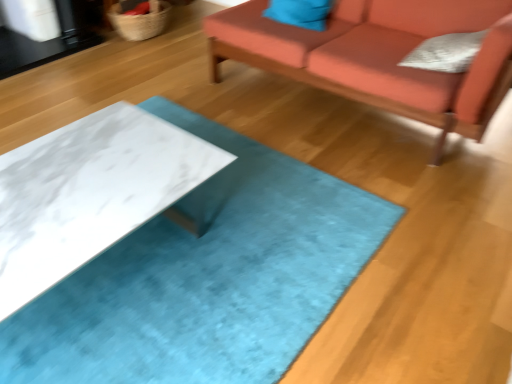
Question: From the image's perspective, is white marble table at center above or below white textured pillow at upper right, the 1th pillow positioned from the front?

Choices:
 (A) below
 (B) above

Answer: (A)

Question: Would you say white marble table at center is inside or outside white textured pillow at upper right, the 1th pillow positioned from the front?

Choices:
 (A) inside
 (B) outside

Answer: (B)

Question: Which of these objects is positioned closest to the woven natural fiber basket at upper left?

Choices:
 (A) white marble table at center
 (B) white textured pillow at upper right, positioned as the second pillow in back-to-front order
 (C) matte blue pillow at upper center, which is counted as the second pillow, starting from the bottom
 (D) velvet orange couch at upper right

Answer: (C)

Question: Based on their relative distances, which object is nearer to the velvet orange couch at upper right?

Choices:
 (A) white marble table at center
 (B) white textured pillow at upper right, the first pillow when ordered from right to left
 (C) woven natural fiber basket at upper left
 (D) matte blue pillow at upper center, which is the second pillow from right to left

Answer: (B)